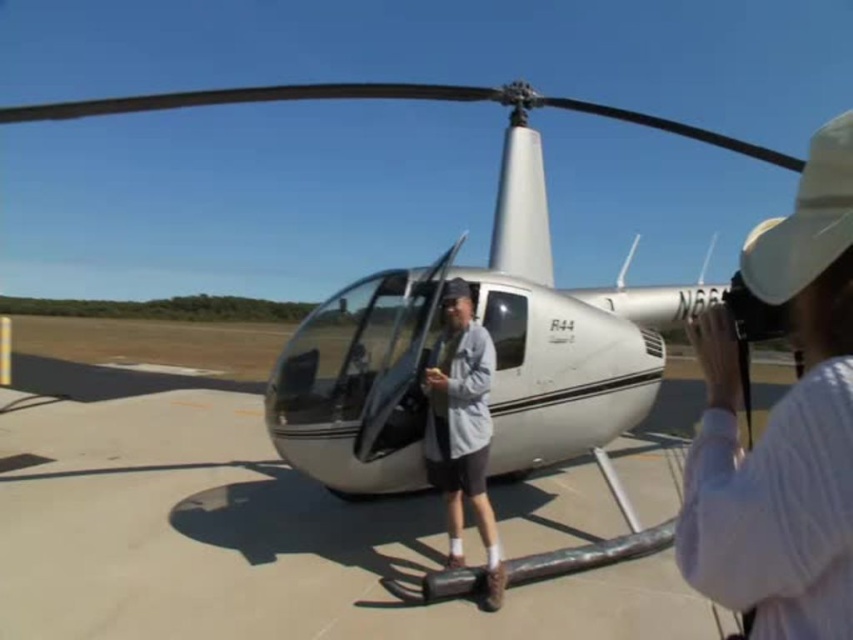
You are standing at the edge of the tarmac and want to place a 36 inch long ladder on the smooth concrete tarmac at center. Can the ladder fit entirely on the tarmac without overhanging?

The smooth concrete tarmac at center and viewer are 35.79 inches apart. Since the ladder is 36 inches long, it would overhang slightly beyond the tarmac.

You are a photographer trying to capture a clear photo of the white glossy helicopter at center. However, there is a white cotton hat at upper right in the frame. Based on their sizes, which object should you focus on to ensure the helicopter is the main subject?

The white cotton hat at upper right is smaller than the white glossy helicopter at center, so focusing on the larger white glossy helicopter at center will ensure it becomes the main subject in the photo.